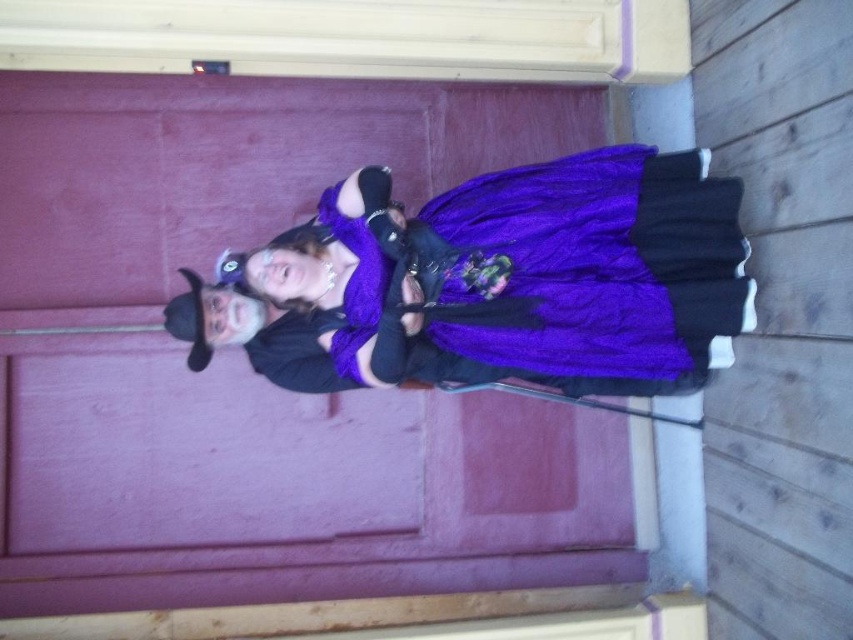
Question: Is purple matte door at center to the left of purple velvet dress at center from the viewer's perspective?

Choices:
 (A) yes
 (B) no

Answer: (A)

Question: In this image, where is purple matte door at center located relative to purple velvet dress at center?

Choices:
 (A) below
 (B) above

Answer: (A)

Question: Which of the following is the farthest from the observer?

Choices:
 (A) purple matte door at center
 (B) purple velvet dress at center

Answer: (A)

Question: Which of the following is the closest to the observer?

Choices:
 (A) purple velvet dress at center
 (B) purple matte door at center

Answer: (A)

Question: Is purple matte door at center thinner than purple velvet dress at center?

Choices:
 (A) yes
 (B) no

Answer: (B)